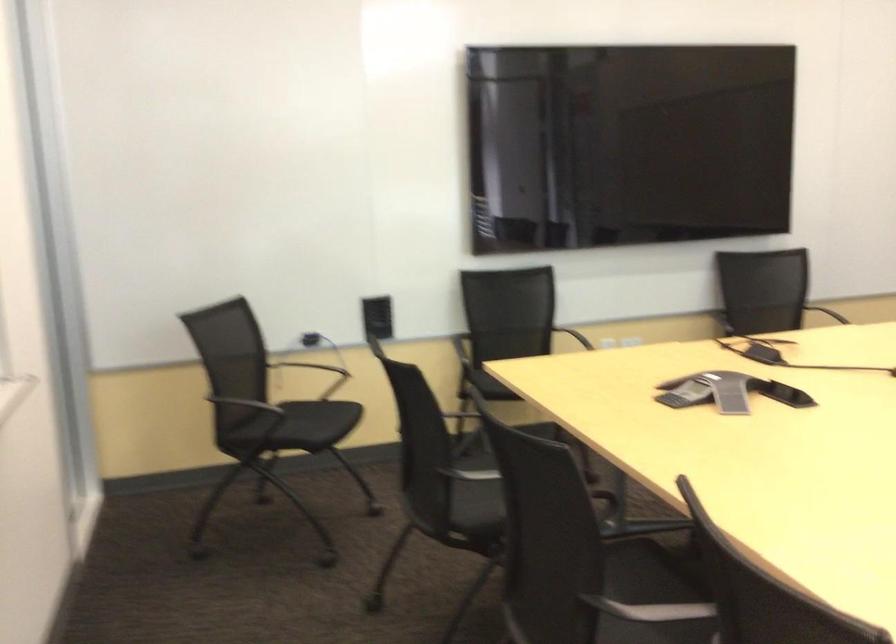
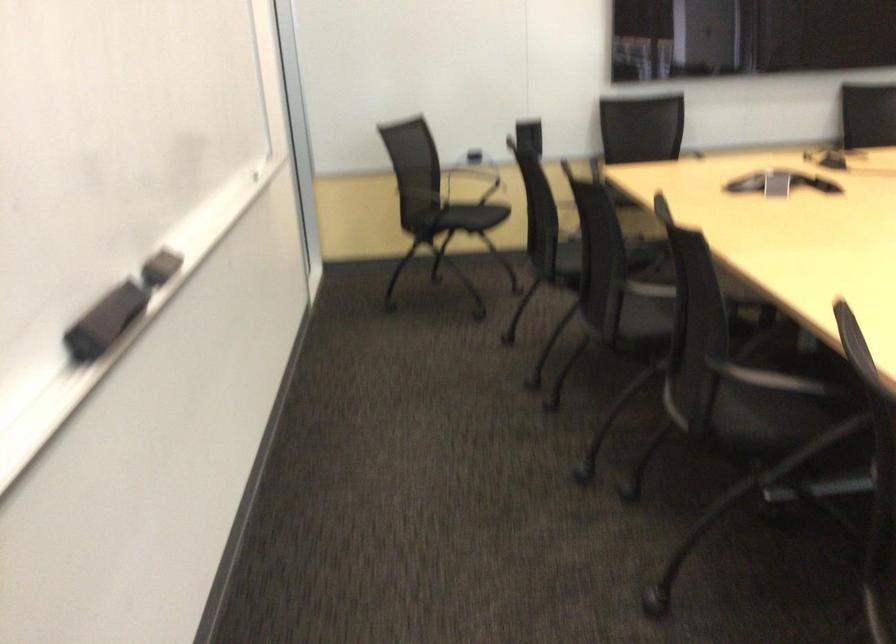
The point at (296, 373) is marked in the first image. Where is the corresponding point in the second image?

(472, 180)